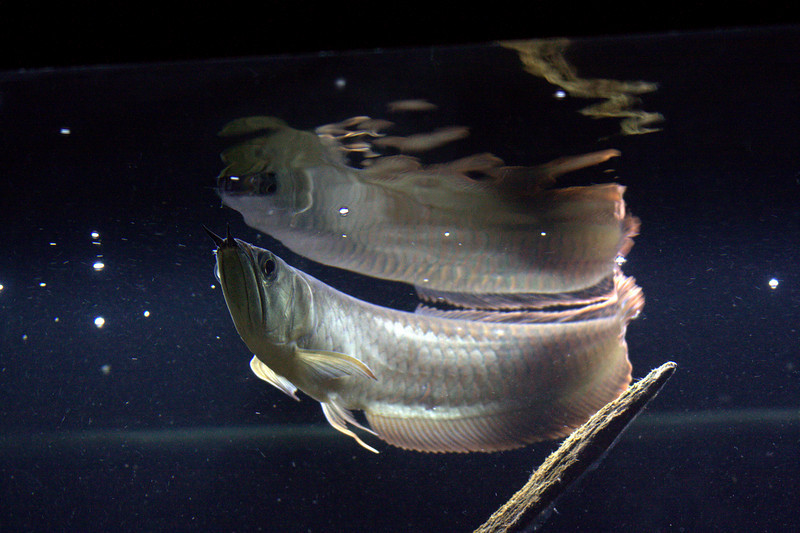
The width and height of the screenshot is (800, 533). In order to click on fish tank in this screenshot , I will do (210, 72).